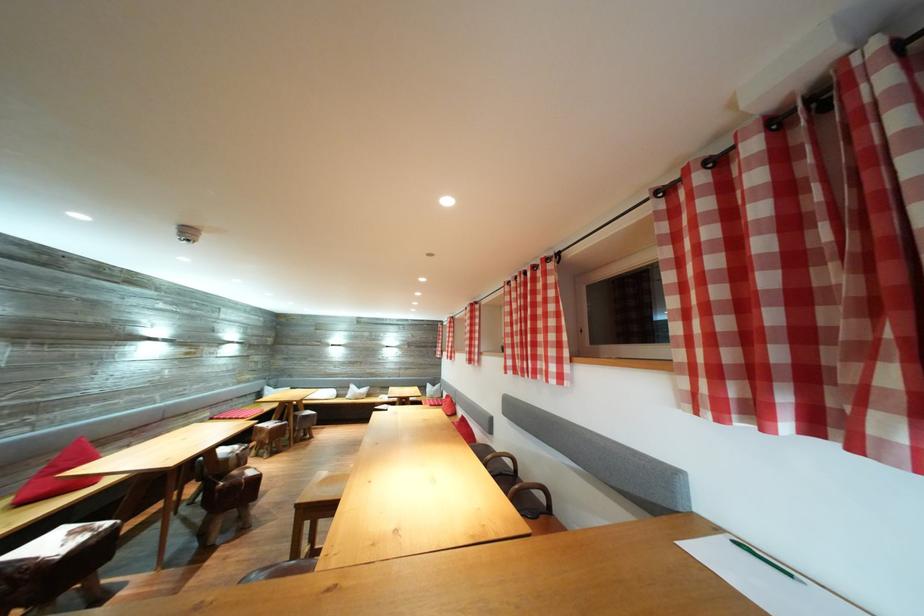
What are the coordinates of `green pencil` in the screenshot? It's located at (764, 560).